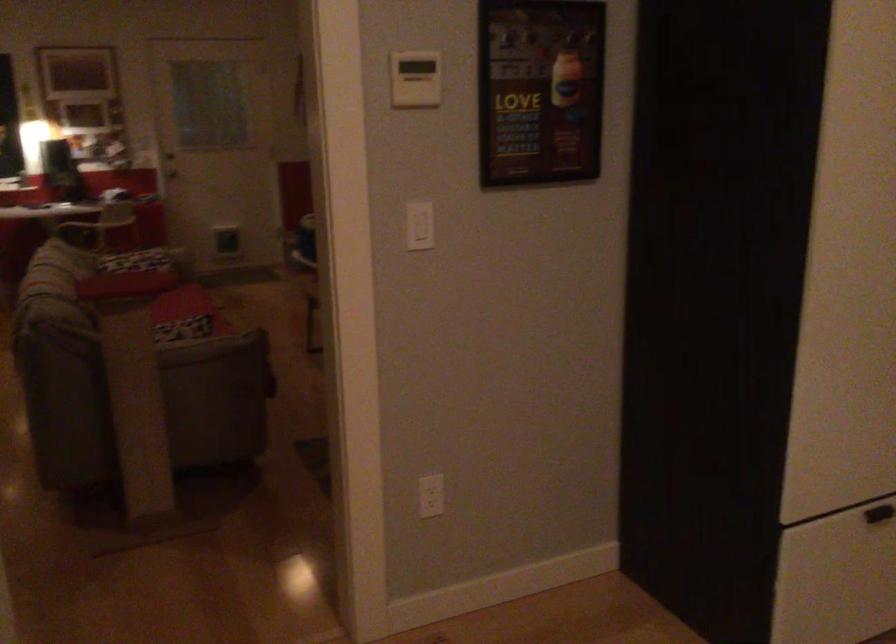
This screenshot has width=896, height=644. Describe the element at coordinates (431, 496) in the screenshot. I see `the white electrical outlet` at that location.